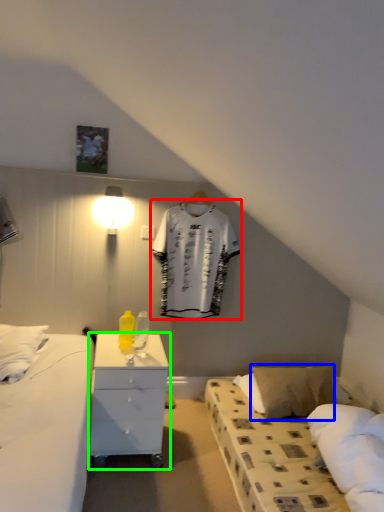
Question: Which is farther away from clothing (highlighted by a red box)? pillow (highlighted by a blue box) or nightstand (highlighted by a green box)?

Choices:
 (A) pillow
 (B) nightstand

Answer: (A)